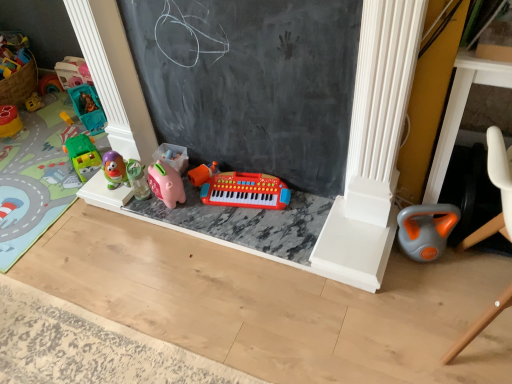
The width and height of the screenshot is (512, 384). Identify the location of free space in front of rubberized plastic keyboard at center, which is the second toy in right-to-left order. (259, 233).